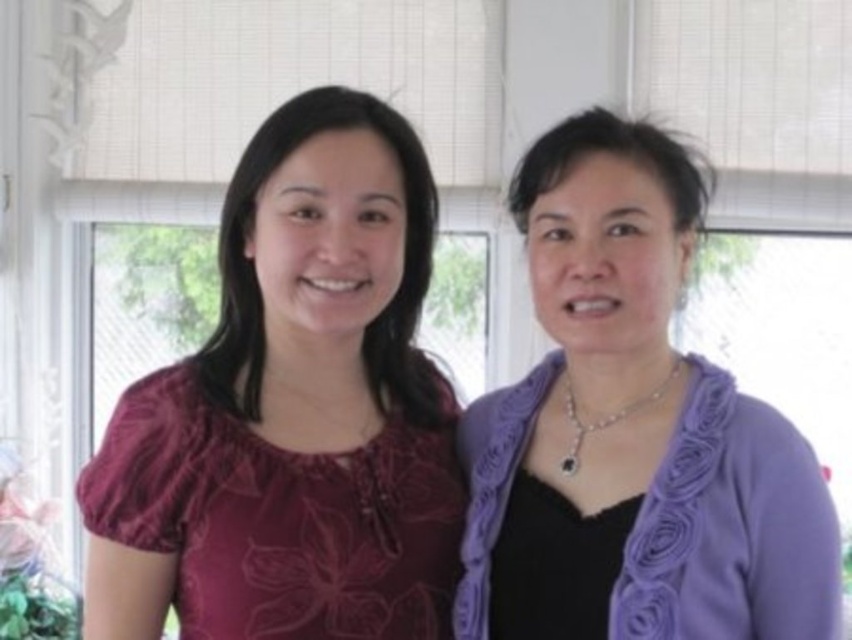
Question: Does matte floral blouse at center have a lesser width compared to purple fabric at right?

Choices:
 (A) no
 (B) yes

Answer: (A)

Question: Can you confirm if matte floral blouse at center is positioned below purple fabric at right?

Choices:
 (A) no
 (B) yes

Answer: (A)

Question: Which of the following is the closest to the observer?

Choices:
 (A) purple fabric at right
 (B) matte floral blouse at center

Answer: (A)

Question: Is matte floral blouse at center positioned behind purple fabric at right?

Choices:
 (A) yes
 (B) no

Answer: (A)

Question: Which point is farther to the camera?

Choices:
 (A) matte floral blouse at center
 (B) purple fabric at right

Answer: (A)